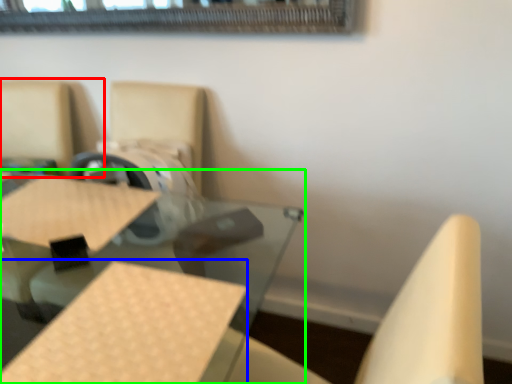
Question: Estimate the real-world distances between objects in this image. Which object is farther from chair (highlighted by a red box), plywood (highlighted by a blue box) or table (highlighted by a green box)?

Choices:
 (A) plywood
 (B) table

Answer: (A)